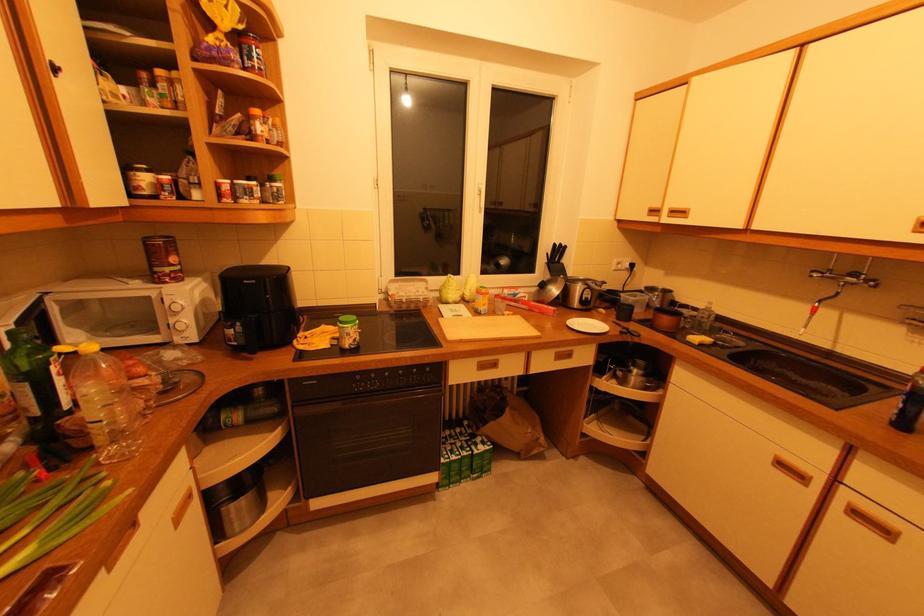
Locate an element on the screen. faucet lever is located at coordinates (837, 286).